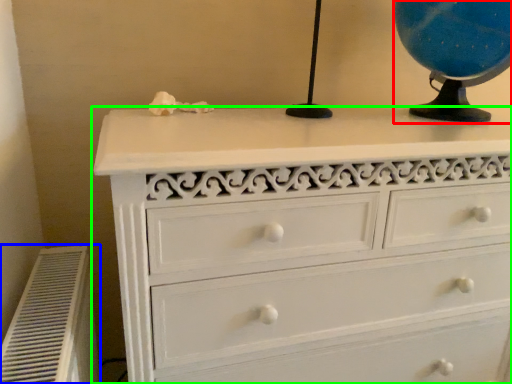
Question: Based on their relative distances, which object is nearer to table lamp (highlighted by a red box)? Choose from air conditioner (highlighted by a blue box) and chest of drawers (highlighted by a green box).

Choices:
 (A) air conditioner
 (B) chest of drawers

Answer: (B)